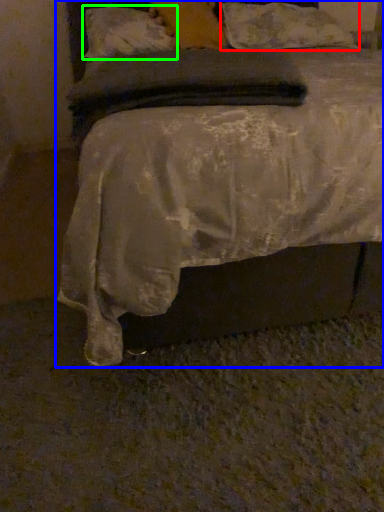
Question: Based on their relative distances, which object is farther from pillow (highlighted by a red box)? Choose from bed (highlighted by a blue box) and pillow (highlighted by a green box).

Choices:
 (A) bed
 (B) pillow

Answer: (A)